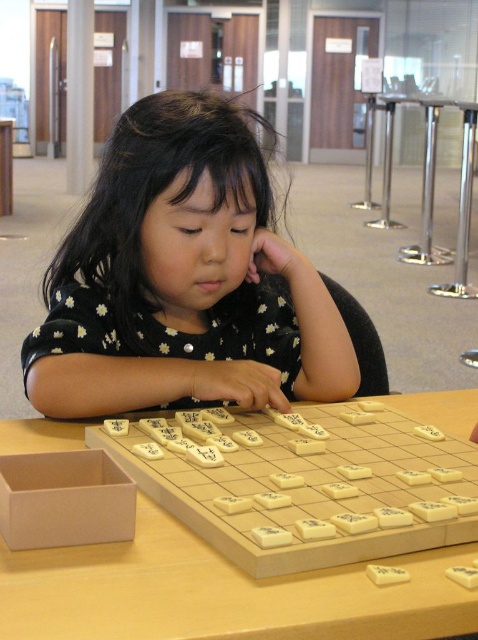
Can you confirm if black dotted shirt at center is positioned to the left of wooden at center?

In fact, black dotted shirt at center is to the right of wooden at center.

Which is more to the right, black dotted shirt at center or wooden at center?

Positioned to the right is black dotted shirt at center.

Does point (133, 276) lie in front of point (325, 588)?

No.

Locate an element on the screen. The width and height of the screenshot is (478, 640). black dotted shirt at center is located at coordinates (182, 280).